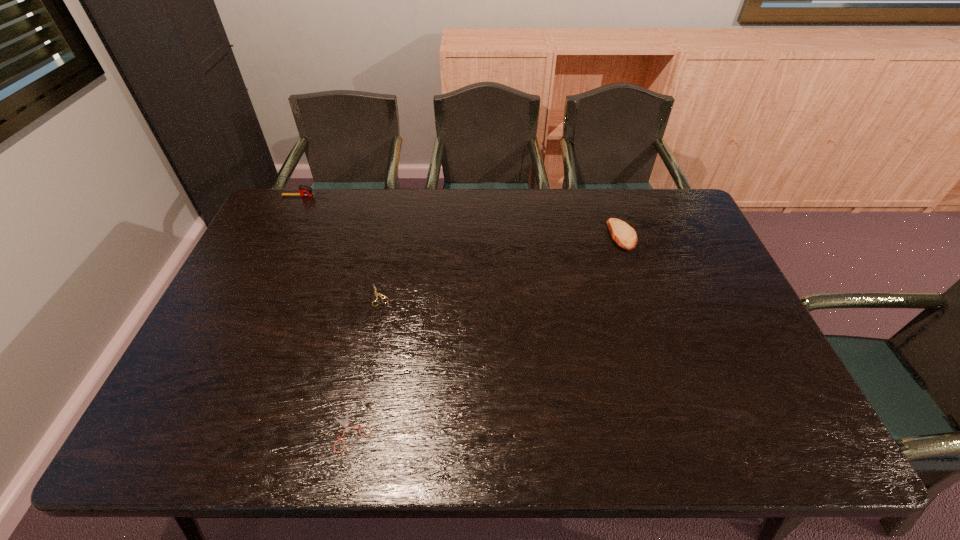
The width and height of the screenshot is (960, 540). In the image, there is a desktop. Identify the location of vacant region at the near right corner. pos(785,421).

This screenshot has width=960, height=540. Find the location of `vacant space in between the third farthest object and the farthest object`. vacant space in between the third farthest object and the farthest object is located at coordinates (343, 245).

Find the location of `free space between the shortest object and the tape measure`. free space between the shortest object and the tape measure is located at coordinates (328, 313).

The image size is (960, 540). Identify the location of vacant point located between the rightmost object and the nearer shears. (487, 333).

At what (x,y) coordinates should I click in order to perform the action: click on vacant area that lies between the rightmost object and the shortest object. Please return your answer as a coordinate pair (x, y). Looking at the image, I should click on (487, 333).

This screenshot has width=960, height=540. Find the location of `unoccupied position between the second farthest object and the third farthest object`. unoccupied position between the second farthest object and the third farthest object is located at coordinates (501, 265).

Where is `free spot between the third nearest object and the farther shears`? The image size is (960, 540). free spot between the third nearest object and the farther shears is located at coordinates (501, 265).

Identify the location of free space between the pita bread and the second shortest object. (501, 265).

You are a GUI agent. You are given a task and a screenshot of the screen. Output one action in this format:
    pyautogui.click(x=<x>, y=<y>)
    Task: Click on the free point between the rightmost object and the farther shears
    The height and width of the screenshot is (540, 960).
    Given the screenshot: What is the action you would take?
    pyautogui.click(x=501, y=265)

Find the location of `unoccupied area between the shorter shears and the tape measure`. unoccupied area between the shorter shears and the tape measure is located at coordinates (328, 313).